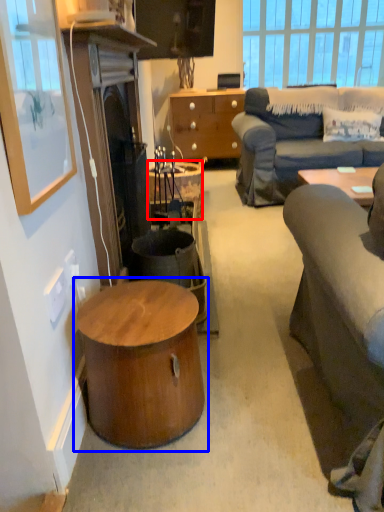
Question: Which point is closer to the camera, desk (highlighted by a red box) or coffee table (highlighted by a blue box)?

Choices:
 (A) desk
 (B) coffee table

Answer: (B)